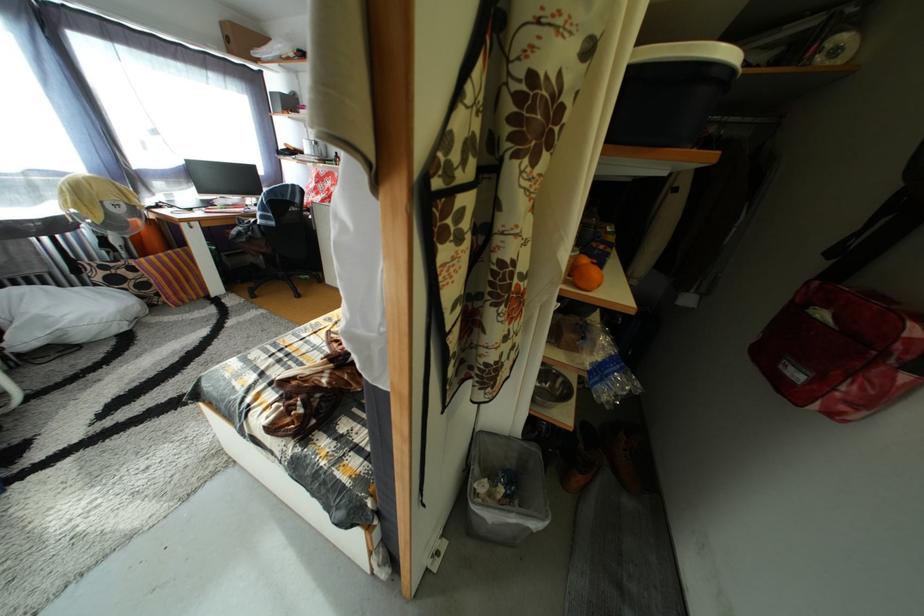
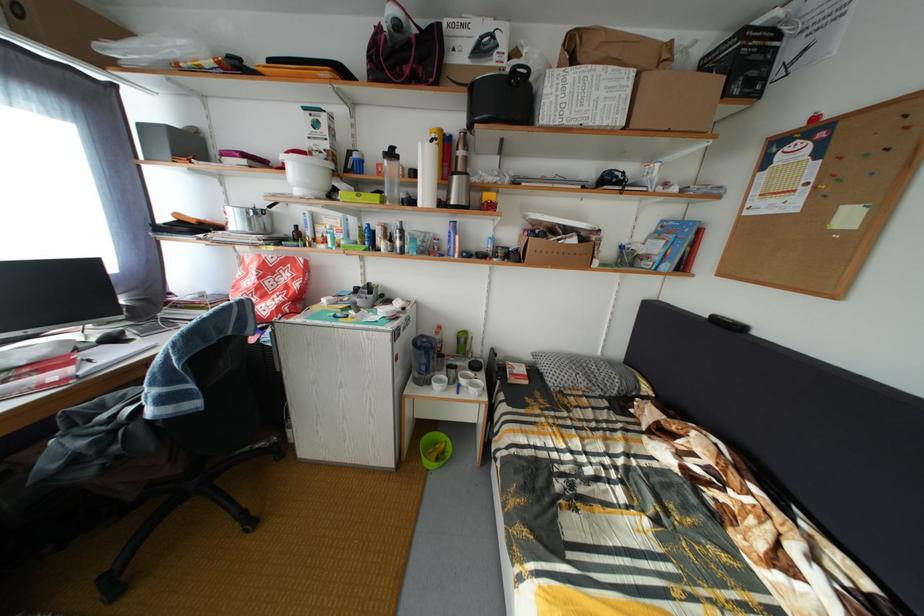
Locate, in the second image, the point that corresponds to (331,179) in the first image.

(281, 267)